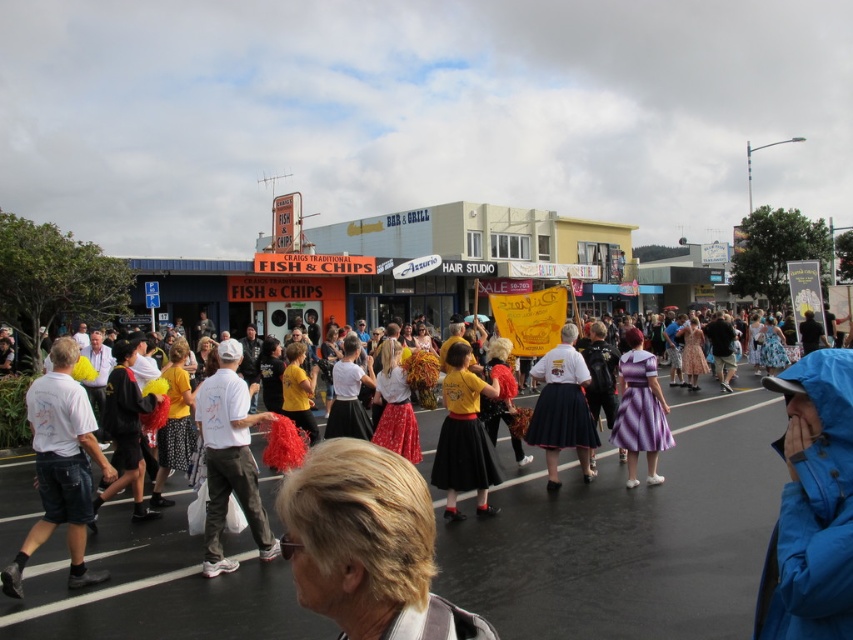
Who is lower down, blue waterproof jacket at lower right or white cotton t-shirt at left?

white cotton t-shirt at left

Can you confirm if blue waterproof jacket at lower right is shorter than white cotton t-shirt at left?

Yes.

Is point (780, 604) closer to camera compared to point (62, 380)?

Yes, point (780, 604) is in front of point (62, 380).

The width and height of the screenshot is (853, 640). In order to click on blue waterproof jacket at lower right in this screenshot , I will do `click(811, 506)`.

Is yellow fabric banner at center to the right of yellow fabric skirt at center from the viewer's perspective?

Correct, you'll find yellow fabric banner at center to the right of yellow fabric skirt at center.

Identify the location of yellow fabric banner at center. (691, 349).

Where is `yellow fabric banner at center`? yellow fabric banner at center is located at coordinates (691, 349).

Is the position of blonde hair at center less distant than that of matte black skirt at center?

Yes, blonde hair at center is closer to the viewer.

Is point (368, 515) in front of point (546, 456)?

Yes, point (368, 515) is in front of point (546, 456).

Who is more distant from viewer, (x=376, y=547) or (x=563, y=397)?

The point (x=563, y=397) is behind.

Locate an element on the screen. The width and height of the screenshot is (853, 640). blonde hair at center is located at coordinates (367, 545).